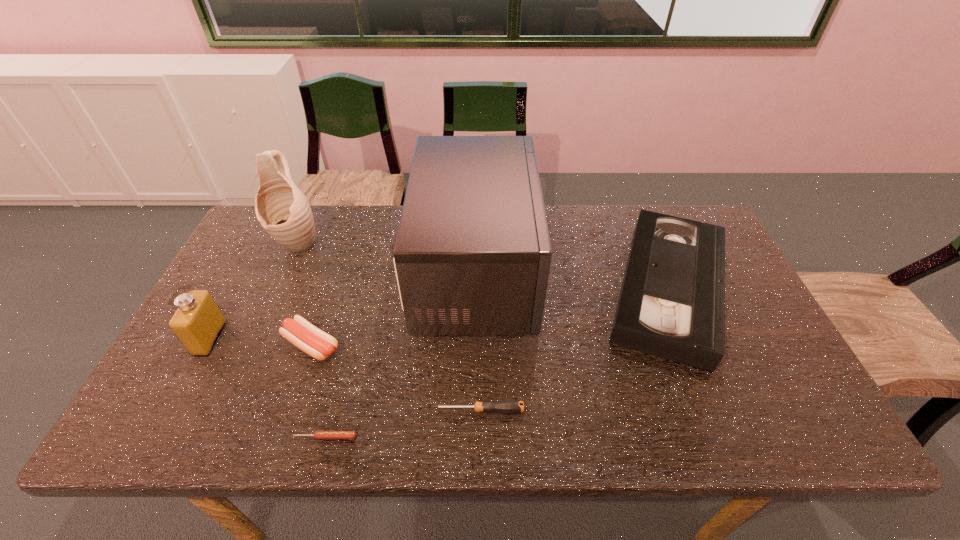
Image resolution: width=960 pixels, height=540 pixels. Identify the location of vacant space in between the microwave oven and the third tallest object. (344, 305).

In order to click on object that is the third closest to the microwave oven in this screenshot , I will do `click(508, 406)`.

The height and width of the screenshot is (540, 960). I want to click on object that stands as the fifth closest to the nearest object, so pyautogui.click(x=282, y=209).

Find the location of a particular element. The width and height of the screenshot is (960, 540). free spot that satisfies the following two spatial constraints: 1. at the spout of the pitcher; 2. on the right side of the screwdriver is located at coordinates (223, 410).

Locate an element on the screen. The height and width of the screenshot is (540, 960). blank area in the image that satisfies the following two spatial constraints: 1. at the spout of the pitcher; 2. on the right side of the nearest object is located at coordinates (211, 437).

The image size is (960, 540). I want to click on blank space that satisfies the following two spatial constraints: 1. on the back side of the sixth farthest object; 2. on the front-facing side of the leftmost object, so click(x=479, y=339).

Find the location of a particular element. blank space that satisfies the following two spatial constraints: 1. on the front-facing side of the microwave oven; 2. on the left side of the screwdriver is located at coordinates point(476,410).

At what (x,y) coordinates should I click in order to perform the action: click on vacant space that satisfies the following two spatial constraints: 1. at the spout of the rightmost object; 2. on the left side of the pitcher. Please return your answer as a coordinate pair (x, y). Looking at the image, I should click on (277, 289).

Where is `free region that satisfies the following two spatial constraints: 1. at the spout of the sixth farthest object; 2. on the right side of the pitcher`? free region that satisfies the following two spatial constraints: 1. at the spout of the sixth farthest object; 2. on the right side of the pitcher is located at coordinates (223, 410).

Locate an element on the screen. Image resolution: width=960 pixels, height=540 pixels. free space that satisfies the following two spatial constraints: 1. on the back side of the second shortest object; 2. on the left side of the videotape is located at coordinates (479, 289).